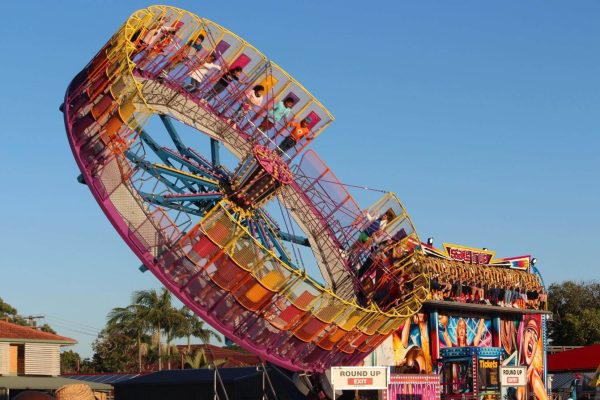
Locate an element on the screen. The width and height of the screenshot is (600, 400). silver frame of sign is located at coordinates (387, 376), (500, 374).